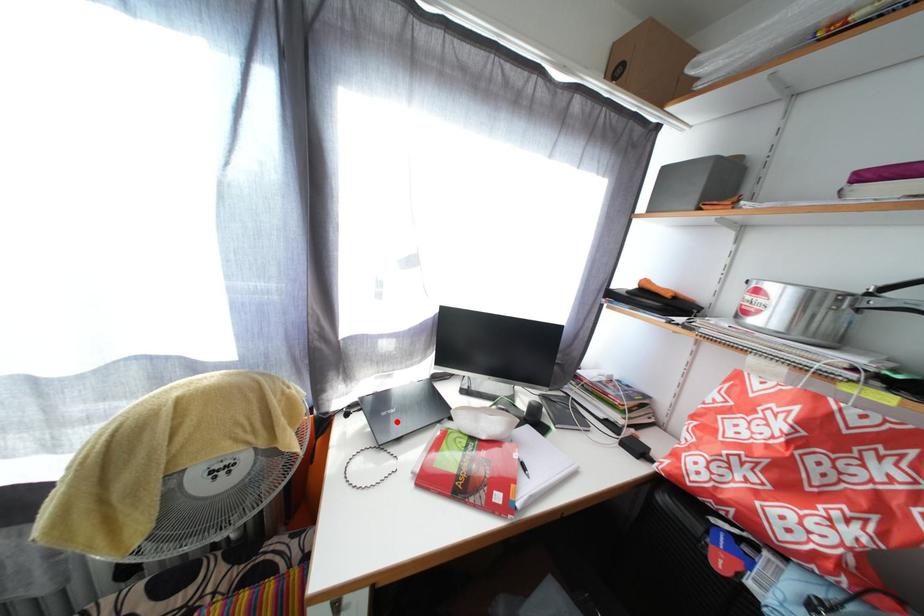
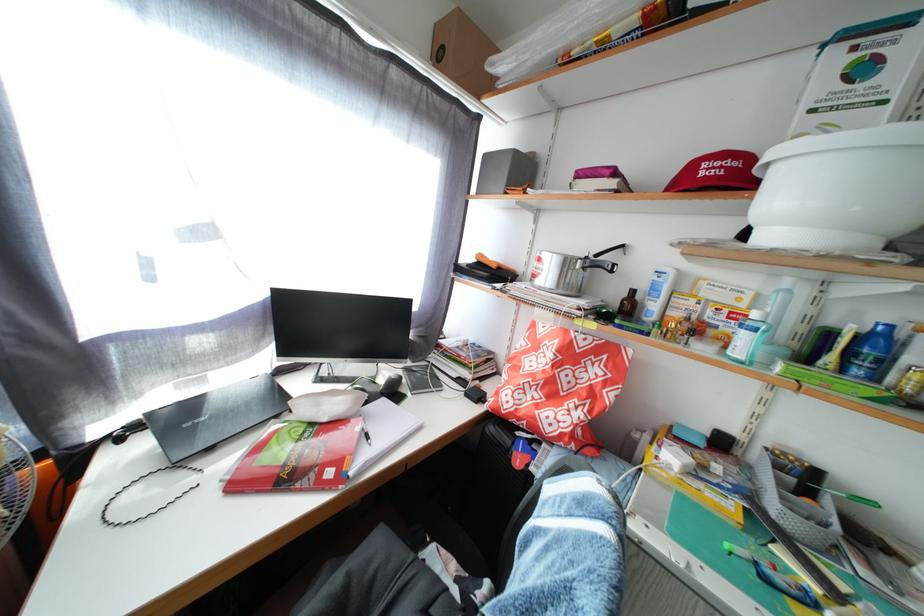
Question: I am providing you with two images of the same scene from different viewpoints. A red point is marked on the first image. Is the red point's position out of view in image 2?

Choices:
 (A) Yes
 (B) No

Answer: (B)